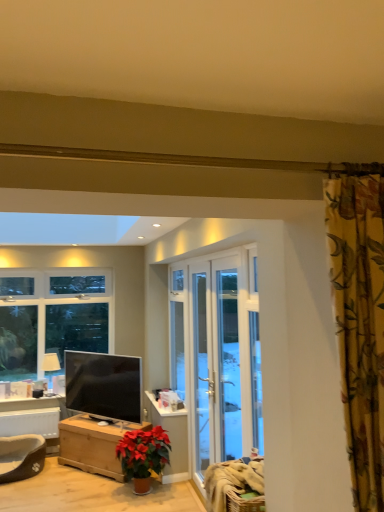
Question: Is white glass door at center, the 2th screen door viewed from the front, a part of dark brown plush pet bed at lower left?

Choices:
 (A) no
 (B) yes

Answer: (A)

Question: Considering the relative sizes of dark brown plush pet bed at lower left and white glass door at center, positioned as the first screen door in back-to-front order, in the image provided, is dark brown plush pet bed at lower left shorter than white glass door at center, positioned as the first screen door in back-to-front order,?

Choices:
 (A) yes
 (B) no

Answer: (A)

Question: From a real-world perspective, is dark brown plush pet bed at lower left physically below white glass door at center, positioned as the first screen door in back-to-front order?

Choices:
 (A) no
 (B) yes

Answer: (B)

Question: Is dark brown plush pet bed at lower left oriented towards white glass door at center, the 2th screen door viewed from the front?

Choices:
 (A) no
 (B) yes

Answer: (A)

Question: Considering the relative sizes of dark brown plush pet bed at lower left and white glass door at center, the 2th screen door viewed from the front, in the image provided, is dark brown plush pet bed at lower left taller than white glass door at center, the 2th screen door viewed from the front,?

Choices:
 (A) yes
 (B) no

Answer: (B)

Question: In terms of width, does floral fabric curtain at upper right look wider or thinner when compared to white glass door at center, which appears as the first screen door when viewed from the front?

Choices:
 (A) thin
 (B) wide

Answer: (B)

Question: Considering their positions, is floral fabric curtain at upper right located in front of or behind white glass door at center, which appears as the first screen door when viewed from the front?

Choices:
 (A) front
 (B) behind

Answer: (A)

Question: Is floral fabric curtain at upper right inside or outside of white glass door at center, marked as the 2th screen door in a back-to-front arrangement?

Choices:
 (A) inside
 (B) outside

Answer: (B)

Question: From the image's perspective, is floral fabric curtain at upper right positioned above or below white glass door at center, marked as the 2th screen door in a back-to-front arrangement?

Choices:
 (A) below
 (B) above

Answer: (B)

Question: Does point click(x=49, y=364) appear closer or farther from the camera than point click(x=59, y=404)?

Choices:
 (A) closer
 (B) farther

Answer: (A)

Question: Considering the positions of matte white lamp at left and white painted wood table at lower left in the image, is matte white lamp at left taller or shorter than white painted wood table at lower left?

Choices:
 (A) tall
 (B) short

Answer: (B)

Question: Is matte white lamp at left wider or thinner than white painted wood table at lower left?

Choices:
 (A) wide
 (B) thin

Answer: (A)

Question: From the image's perspective, is matte white lamp at left located above or below white painted wood table at lower left?

Choices:
 (A) above
 (B) below

Answer: (A)

Question: From a real-world perspective, is dark brown plush pet bed at lower left physically located above or below white glass door at center, the 2th screen door viewed from the front?

Choices:
 (A) above
 (B) below

Answer: (B)

Question: Looking at the image, does dark brown plush pet bed at lower left seem bigger or smaller compared to white glass door at center, the 2th screen door viewed from the front?

Choices:
 (A) big
 (B) small

Answer: (B)